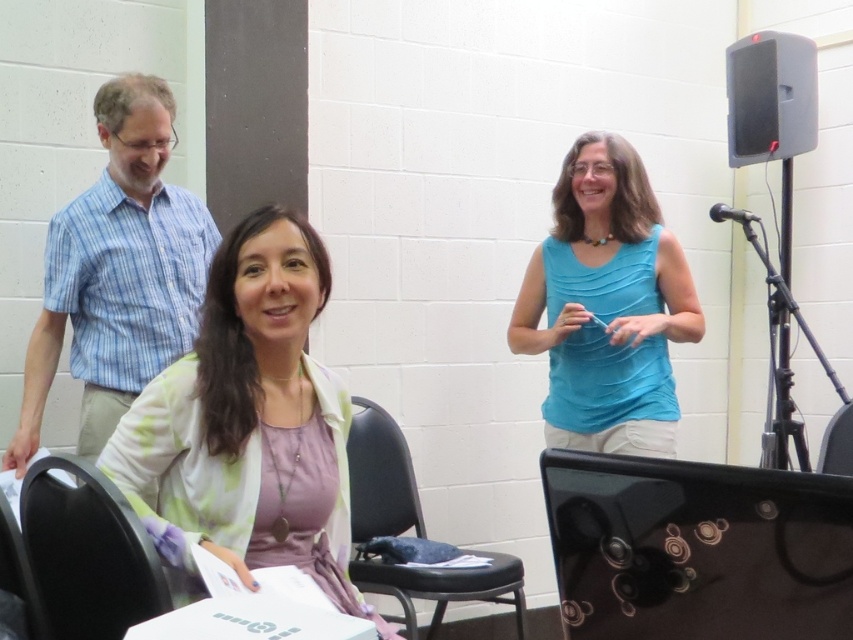
Between black glossy laptop at lower right and black fabric chair at lower center, which one is positioned higher?

Positioned higher is black glossy laptop at lower right.

Who is more forward, (583, 529) or (476, 573)?

Positioned in front is point (583, 529).

You are a GUI agent. You are given a task and a screenshot of the screen. Output one action in this format:
    pyautogui.click(x=<x>, y=<y>)
    Task: Click on the black glossy laptop at lower right
    The width and height of the screenshot is (853, 640).
    Given the screenshot: What is the action you would take?
    pyautogui.click(x=697, y=548)

Does black glossy laptop at lower right have a smaller size compared to black plastic chair at lower right?

No, black glossy laptop at lower right is not smaller than black plastic chair at lower right.

Who is more distant from viewer, [811,586] or [825,460]?

Point [825,460]

Which is in front, point (672, 598) or point (850, 458)?

Point (672, 598) is more forward.

The image size is (853, 640). What are the coordinates of `black glossy laptop at lower right` in the screenshot? It's located at (697, 548).

Does pastel floral cardigan at center lie in front of blue plaid shirt at upper left?

Yes.

Between pastel floral cardigan at center and blue plaid shirt at upper left, which one has more height?

With more height is blue plaid shirt at upper left.

Image resolution: width=853 pixels, height=640 pixels. In order to click on pastel floral cardigan at center in this screenshot , I will do `click(248, 422)`.

The width and height of the screenshot is (853, 640). In order to click on pastel floral cardigan at center in this screenshot , I will do `click(248, 422)`.